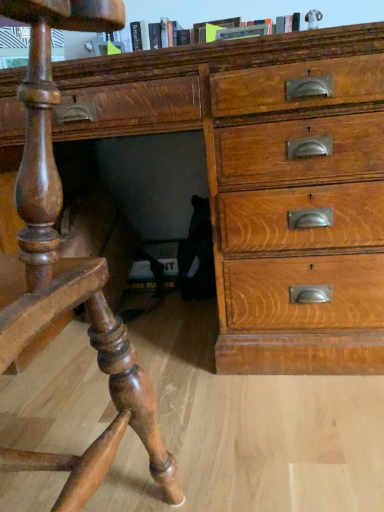
Question: Is shiny polished wood desk at lower left inside or outside of hardcover book at upper center?

Choices:
 (A) inside
 (B) outside

Answer: (B)

Question: In terms of height, does shiny polished wood desk at lower left look taller or shorter compared to hardcover book at upper center?

Choices:
 (A) short
 (B) tall

Answer: (B)

Question: Estimate the real-world distances between objects in this image. Which object is closer to the hardcover book at upper center?

Choices:
 (A) wooden chest of drawers at center
 (B) shiny polished wood desk at lower left

Answer: (A)

Question: Which object is the closest to the wooden chest of drawers at center?

Choices:
 (A) hardcover book at upper center
 (B) shiny polished wood desk at lower left

Answer: (B)